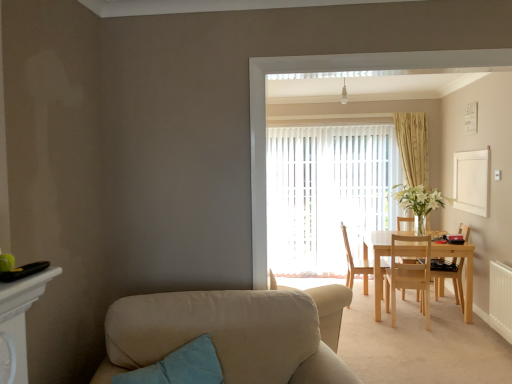
Question: Would you say white vertical blinds at center is part of beige fabric couch at lower left's contents?

Choices:
 (A) yes
 (B) no

Answer: (B)

Question: Considering the relative positions of beige fabric couch at lower left and white vertical blinds at center in the image provided, is beige fabric couch at lower left to the left of white vertical blinds at center from the viewer's perspective?

Choices:
 (A) yes
 (B) no

Answer: (A)

Question: Is beige fabric couch at lower left far from white vertical blinds at center?

Choices:
 (A) no
 (B) yes

Answer: (B)

Question: Does beige fabric couch at lower left have a lesser width compared to white vertical blinds at center?

Choices:
 (A) no
 (B) yes

Answer: (A)

Question: From the image's perspective, is beige fabric couch at lower left below white vertical blinds at center?

Choices:
 (A) no
 (B) yes

Answer: (B)

Question: Does beige fabric couch at lower left have a lesser height compared to white vertical blinds at center?

Choices:
 (A) no
 (B) yes

Answer: (B)

Question: Is light wood table at center smaller than beige textured curtain at center?

Choices:
 (A) no
 (B) yes

Answer: (A)

Question: Does light wood table at center lie in front of beige textured curtain at center?

Choices:
 (A) no
 (B) yes

Answer: (B)

Question: Is light wood table at center taller than beige textured curtain at center?

Choices:
 (A) yes
 (B) no

Answer: (B)

Question: Does light wood table at center contain beige textured curtain at center?

Choices:
 (A) yes
 (B) no

Answer: (B)

Question: Would you consider light wood table at center to be distant from beige textured curtain at center?

Choices:
 (A) yes
 (B) no

Answer: (A)

Question: Can you confirm if light wood table at center is bigger than beige textured curtain at center?

Choices:
 (A) no
 (B) yes

Answer: (B)

Question: Does white vertical blinds at center come behind light wood table at center?

Choices:
 (A) yes
 (B) no

Answer: (A)